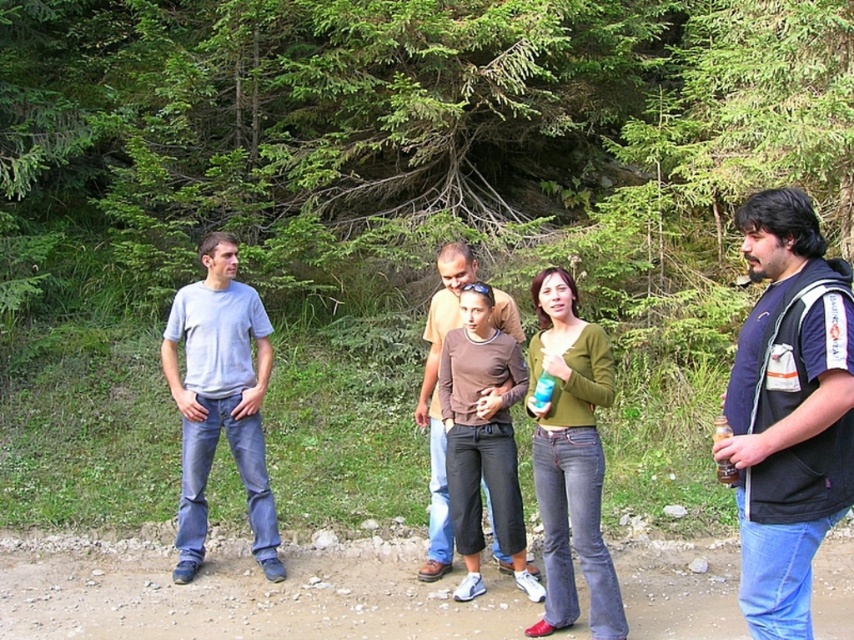
Question: Does light gray t-shirt at left have a larger size compared to blue plastic cup at center?

Choices:
 (A) no
 (B) yes

Answer: (B)

Question: Which of the following is the farthest from the observer?

Choices:
 (A) green matte sweater at center
 (B) brown cotton shirt at center

Answer: (B)

Question: Which object is positioned farthest from the light gray t-shirt at left?

Choices:
 (A) brown cotton shirt at center
 (B) blue plastic cup at center
 (C) green matte sweater at center

Answer: (B)

Question: Does green matte sweater at center appear over blue plastic cup at center?

Choices:
 (A) yes
 (B) no

Answer: (B)

Question: Which object appears farthest from the camera in this image?

Choices:
 (A) dark blue fleece jacket at right
 (B) blue plastic cup at center
 (C) brown cotton shirt at center

Answer: (C)

Question: Does brown cotton shirt at center appear under blue plastic cup at center?

Choices:
 (A) no
 (B) yes

Answer: (B)